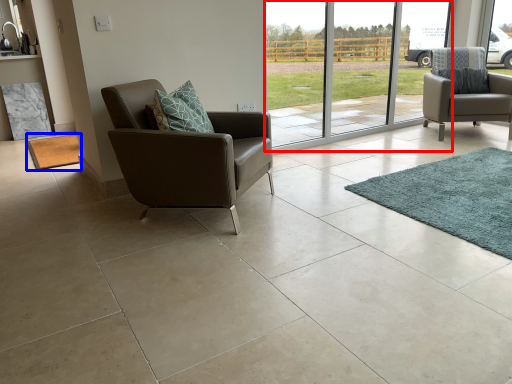
Question: Which point is closer to the camera, glass door (highlighted by a red box) or mat (highlighted by a blue box)?

Choices:
 (A) glass door
 (B) mat

Answer: (A)